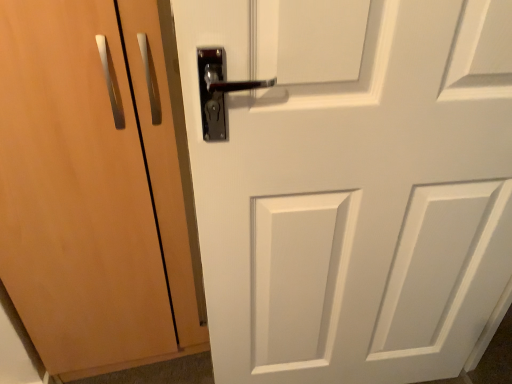
Question: In terms of size, does matte wood door at center, the 2th door positioned from the right, appear bigger or smaller than white matte door at center, the first door from the right?

Choices:
 (A) big
 (B) small

Answer: (A)

Question: From a real-world perspective, relative to white matte door at center, the 2th door positioned from the left, is matte wood door at center, arranged as the 1th door when viewed from the left, vertically above or below?

Choices:
 (A) above
 (B) below

Answer: (B)

Question: Considering the relative positions of matte wood door at center, the 2th door positioned from the right, and white matte door at center, the 2th door positioned from the left, in the image provided, is matte wood door at center, the 2th door positioned from the right, to the left or to the right of white matte door at center, the 2th door positioned from the left,?

Choices:
 (A) left
 (B) right

Answer: (A)

Question: Does point (285, 127) appear closer or farther from the camera than point (158, 11)?

Choices:
 (A) farther
 (B) closer

Answer: (B)

Question: Looking at their shapes, would you say white matte door at center, the first door from the right, is wider or thinner than matte wood door at center, the 2th door positioned from the right?

Choices:
 (A) thin
 (B) wide

Answer: (A)

Question: In the image, is white matte door at center, the first door from the right, positioned in front of or behind matte wood door at center, arranged as the 1th door when viewed from the left?

Choices:
 (A) behind
 (B) front

Answer: (B)

Question: From a real-world perspective, is white matte door at center, the first door from the right, positioned above or below matte wood door at center, the 2th door positioned from the right?

Choices:
 (A) above
 (B) below

Answer: (A)